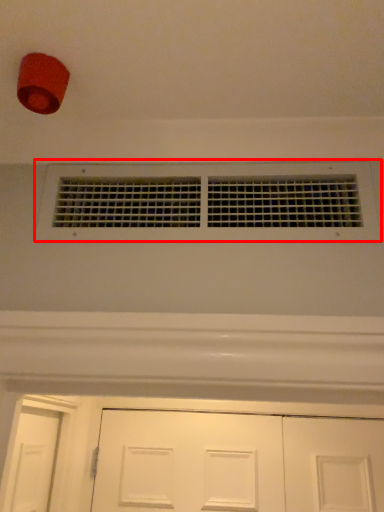
Question: Where is window (annotated by the red box) located in relation to door in the image?

Choices:
 (A) right
 (B) left

Answer: (B)